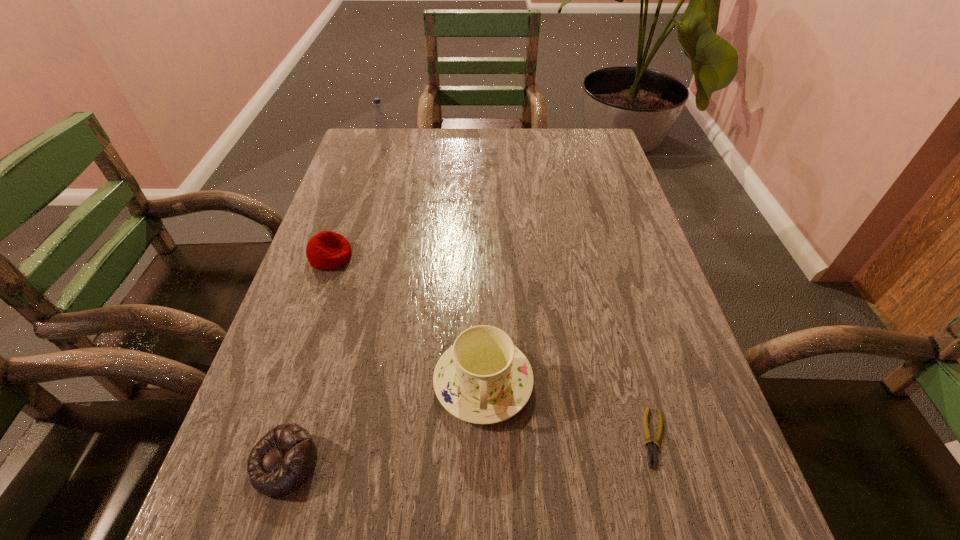
Find the location of a particular element. This screenshot has height=540, width=960. vacant region at the right edge of the desktop is located at coordinates (598, 258).

Find the location of `free region at the far left corner of the desktop`. free region at the far left corner of the desktop is located at coordinates (369, 145).

Locate an element on the screen. free space between the farther beanbag and the water bottle is located at coordinates (358, 203).

Where is `free spot between the fourth shortest object and the farther beanbag`? free spot between the fourth shortest object and the farther beanbag is located at coordinates (407, 319).

This screenshot has height=540, width=960. In order to click on vacant area between the taller beanbag and the second object from right to left in this screenshot , I will do `click(407, 319)`.

I want to click on vacant space in between the chinaware and the pliers, so click(568, 410).

Where is `free space that is in between the shorter beanbag and the fourth nearest object`? Image resolution: width=960 pixels, height=540 pixels. free space that is in between the shorter beanbag and the fourth nearest object is located at coordinates [307, 360].

Locate an element on the screen. This screenshot has width=960, height=540. vacant space that's between the shorter beanbag and the fourth shortest object is located at coordinates (384, 423).

Find the location of a particular element. unoccupied area between the pliers and the nearer beanbag is located at coordinates (469, 450).

Identify the location of vacant space that is in between the chinaware and the shortest object. tap(568, 410).